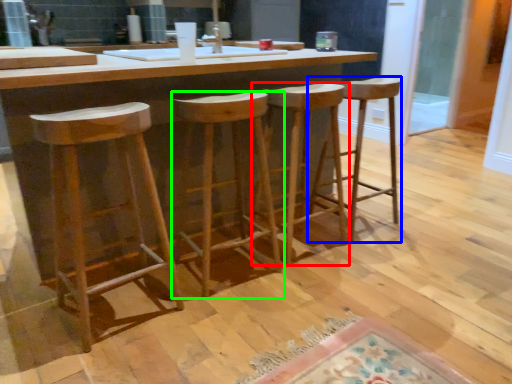
Question: Considering the real-world distances, which object is closest to stool (highlighted by a red box)? stool (highlighted by a blue box) or stool (highlighted by a green box).

Choices:
 (A) stool
 (B) stool

Answer: (A)